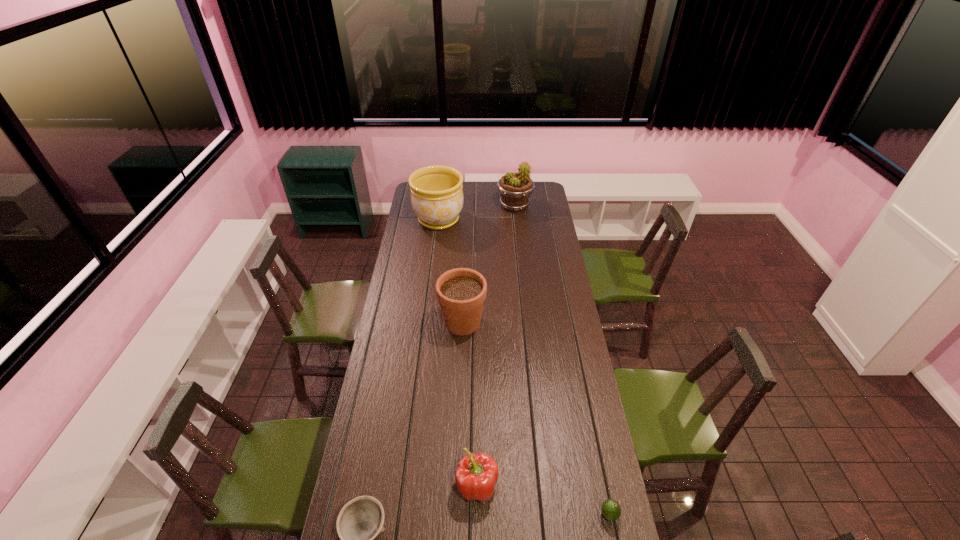
Identify the location of the closest object relative to the second shortest object. Image resolution: width=960 pixels, height=540 pixels. (477, 474).

Identify which object is located as the nearest to the avocado. Please provide its 2D coordinates. Your answer should be formatted as a tuple, i.e. [(x, y)], where the tuple contains the x and y coordinates of a point satisfying the conditions above.

[(477, 474)]

Point out which flowerpot is positioned as the nearest to the rightmost object. Please provide its 2D coordinates. Your answer should be formatted as a tuple, i.e. [(x, y)], where the tuple contains the x and y coordinates of a point satisfying the conditions above.

[(461, 292)]

The width and height of the screenshot is (960, 540). Identify the location of the second closest flowerpot to the fourth tallest object. (437, 198).

Locate an element on the screen. This screenshot has height=540, width=960. vacant area that satisfies the following two spatial constraints: 1. on the back side of the rightmost flowerpot; 2. on the right side of the fourth tallest object is located at coordinates (478, 206).

This screenshot has width=960, height=540. I want to click on vacant space that satisfies the following two spatial constraints: 1. on the front side of the rightmost object; 2. on the right side of the fourth shortest object, so click(455, 515).

Image resolution: width=960 pixels, height=540 pixels. In order to click on free space that satisfies the following two spatial constraints: 1. on the front side of the shortest flowerpot; 2. on the left side of the second shortest object in this screenshot , I will do point(455,515).